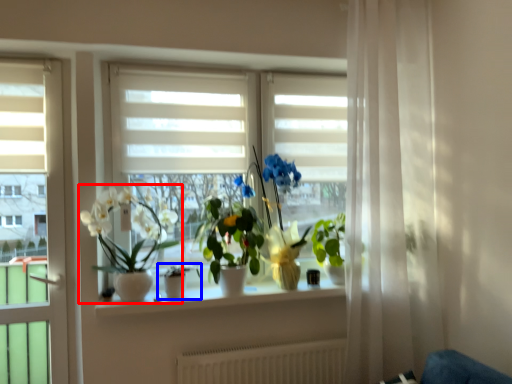
Question: Which object appears farthest to the camera in this image, houseplant (highlighted by a red box) or houseplant (highlighted by a blue box)?

Choices:
 (A) houseplant
 (B) houseplant

Answer: (B)